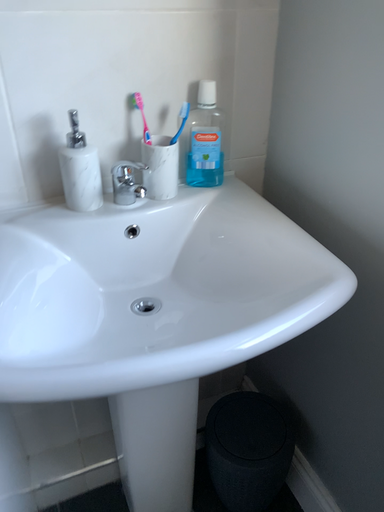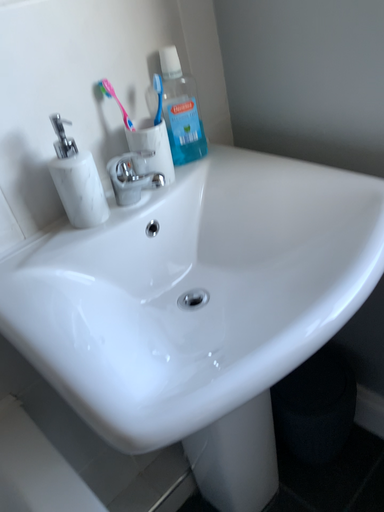
Question: Which way did the camera rotate in the video?

Choices:
 (A) rotated right
 (B) rotated left

Answer: (A)